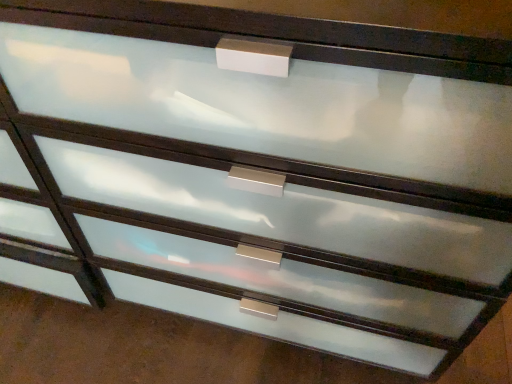
At what (x,y) coordinates should I click in order to perform the action: click on satin silver drawer at center. Please return your answer as a coordinate pair (x, y). This screenshot has width=512, height=384. Looking at the image, I should click on (291, 280).

What do you see at coordinates (291, 280) in the screenshot? I see `satin silver drawer at center` at bounding box center [291, 280].

This screenshot has width=512, height=384. I want to click on satin silver drawer at center, so click(291, 280).